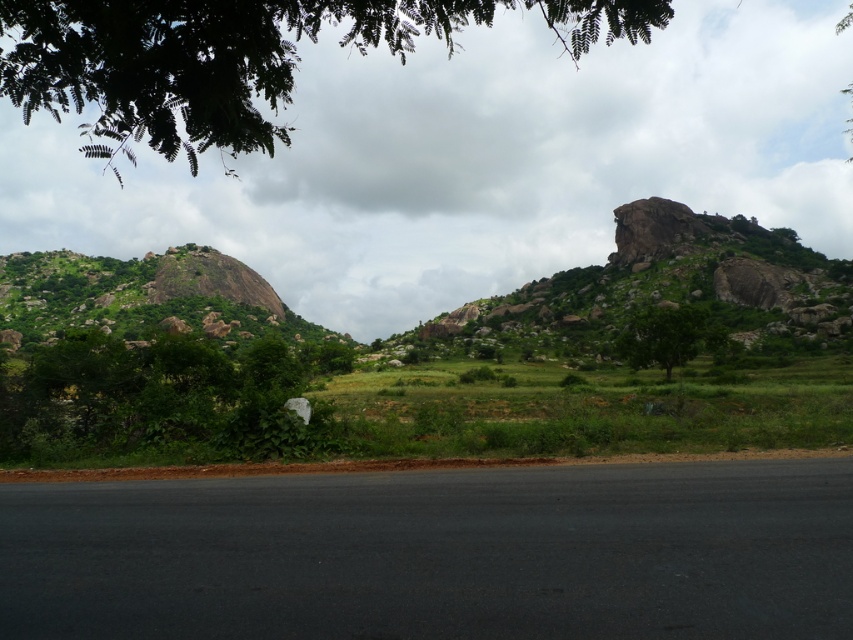
Can you confirm if green leafy tree at lower left is positioned above green leafy tree at center?

No, green leafy tree at lower left is not above green leafy tree at center.

Is green leafy tree at lower left positioned before green leafy tree at center?

Yes.

What do you see at coordinates (152, 397) in the screenshot? I see `green leafy tree at lower left` at bounding box center [152, 397].

Image resolution: width=853 pixels, height=640 pixels. Identify the location of green leafy tree at lower left. (152, 397).

Measure the distance between rugged granite mountain at center and green leafy tree at lower left.

rugged granite mountain at center and green leafy tree at lower left are 72.54 meters apart.

Does rugged granite mountain at center have a greater height compared to green leafy tree at lower left?

Correct, rugged granite mountain at center is much taller as green leafy tree at lower left.

Is point (560, 289) less distant than point (67, 342)?

No, it is not.

Identify the location of rugged granite mountain at center. (677, 284).

Does green rocky mountain at left appear on the right side of green leafy tree at center?

Incorrect, green rocky mountain at left is not on the right side of green leafy tree at center.

Measure the distance between green rocky mountain at left and green leafy tree at center.

green rocky mountain at left and green leafy tree at center are 93.30 meters apart.

Does point (109, 268) come farther from viewer compared to point (645, 356)?

Yes.

Locate an element on the screen. green rocky mountain at left is located at coordinates (151, 301).